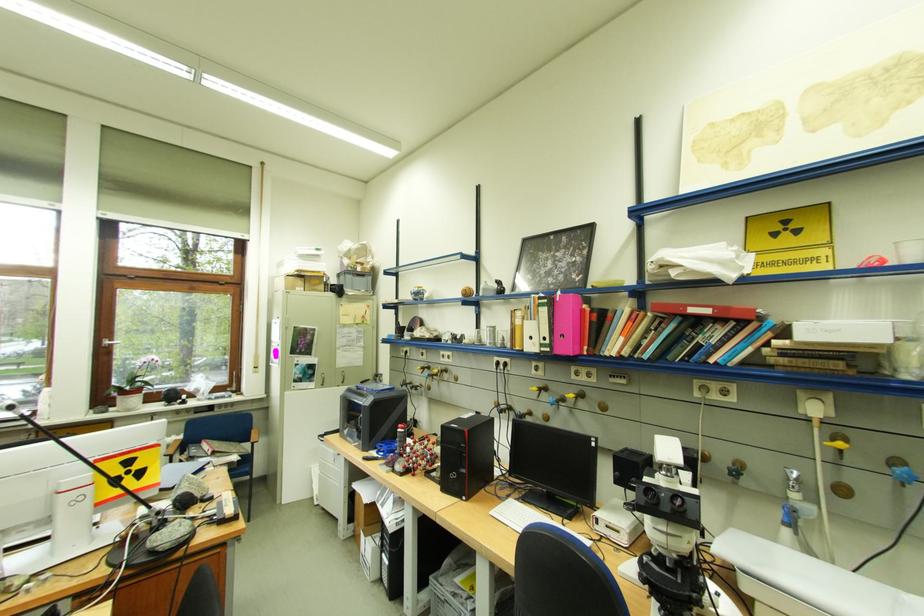
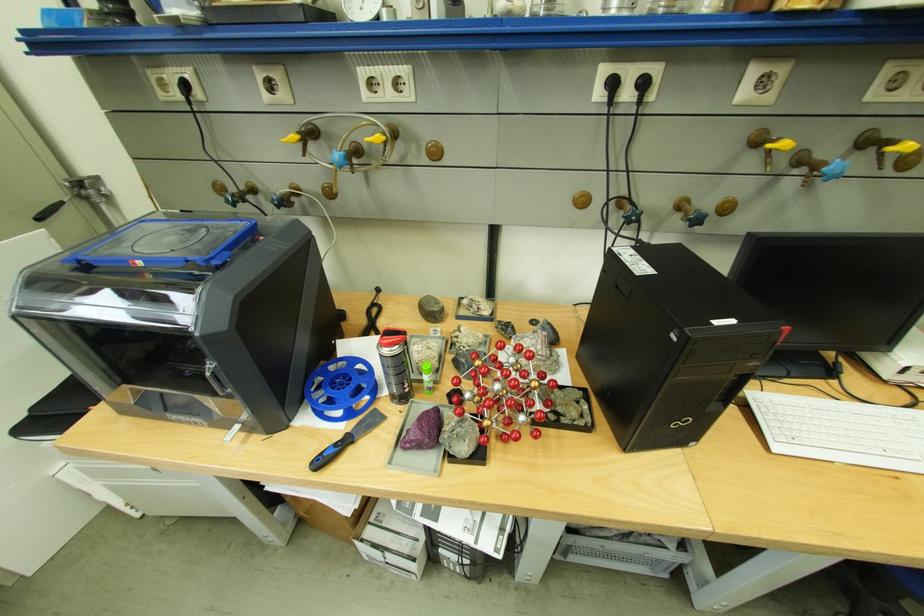
Where in the second image is the point corresponding to the point at 462,374 from the first image?

(428, 140)